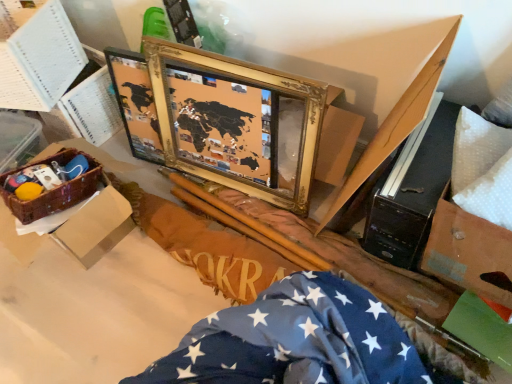
Question: Looking at the image, does white paper at upper left, positioned as the 1th box in top-to-bottom order, seem bigger or smaller compared to brown woven basket at left, the 2th box positioned from the top?

Choices:
 (A) small
 (B) big

Answer: (A)

Question: Does point (41, 109) appear closer or farther from the camera than point (123, 165)?

Choices:
 (A) farther
 (B) closer

Answer: (A)

Question: Based on their relative distances, which object is farther from the brown woven basket at left, which appears as the first box when ordered from the bottom?

Choices:
 (A) blue fabric with white stars at lower right
 (B) woven brown basket at lower left
 (C) white paper at upper left, which appears as the 2th box when ordered from the bottom
 (D) gold/gilded picture frame at center

Answer: (A)

Question: Which is nearer to the gold/gilded picture frame at center?

Choices:
 (A) blue fabric with white stars at lower right
 (B) brown woven basket at left, the 2th box positioned from the top
 (C) woven brown basket at lower left
 (D) white paper at upper left, positioned as the 1th box in top-to-bottom order

Answer: (B)